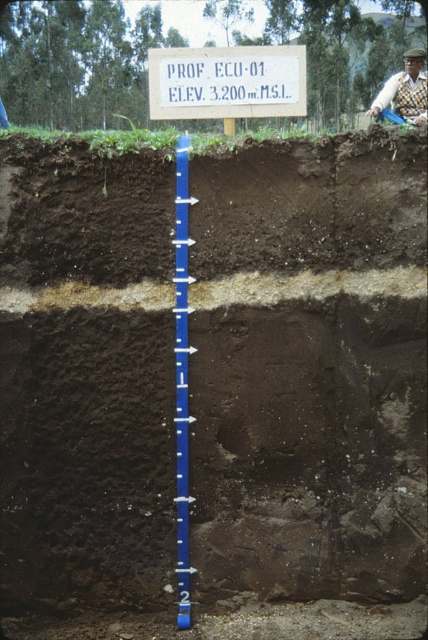
Question: Where is white plastic sign at upper center located in relation to knitted sweater at upper right in the image?

Choices:
 (A) right
 (B) left

Answer: (B)

Question: Which of the following is the farthest from the observer?

Choices:
 (A) knitted sweater at upper right
 (B) dark brown soil at center
 (C) white plastic sign at upper center

Answer: (A)

Question: Is white plastic sign at upper center wider than knitted sweater at upper right?

Choices:
 (A) no
 (B) yes

Answer: (B)

Question: Which point appears closest to the camera in this image?

Choices:
 (A) (15, 264)
 (B) (178, 500)

Answer: (A)

Question: Among these objects, which one is nearest to the camera?

Choices:
 (A) white plastic sign at upper center
 (B) blue plastic ruler at center

Answer: (B)

Question: Is dark brown soil at center below white plastic sign at upper center?

Choices:
 (A) yes
 (B) no

Answer: (A)